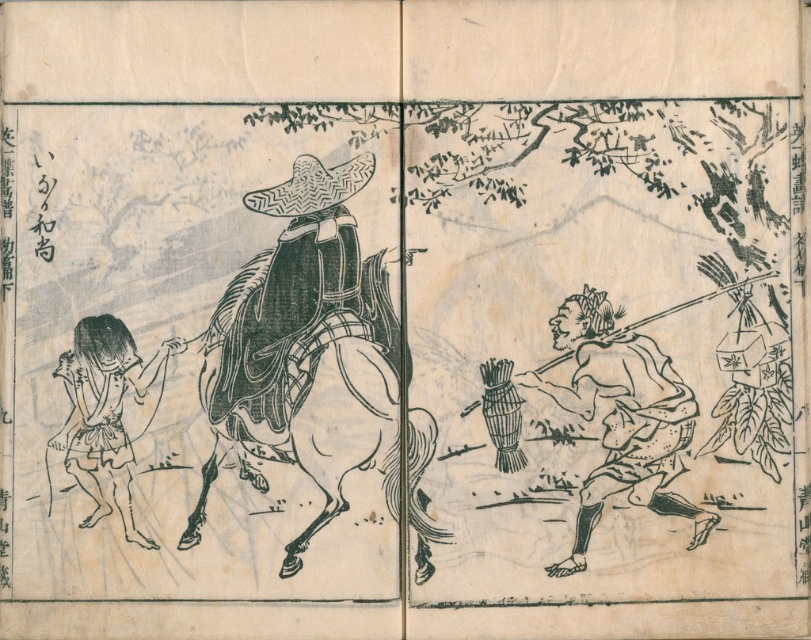
Who is lower down, wooden staff at lower right or black paper doll at lower left?

black paper doll at lower left is below.

Which is more to the right, wooden staff at lower right or black paper doll at lower left?

Positioned to the right is wooden staff at lower right.

Between point (649, 442) and point (121, 344), which one is positioned behind?

The point (649, 442) is more distant.

Where is `wooden staff at lower right`? This screenshot has width=811, height=640. wooden staff at lower right is located at coordinates (621, 417).

Can you confirm if black paper doll at lower left is taller than woven straw hat at center?

Yes.

Can you confirm if black paper doll at lower left is positioned to the right of woven straw hat at center?

In fact, black paper doll at lower left is to the left of woven straw hat at center.

Is point (88, 518) farther from viewer compared to point (282, 202)?

No, it is not.

Where is `black paper doll at lower left`? This screenshot has width=811, height=640. black paper doll at lower left is located at coordinates (108, 413).

Does white paper horse at center have a larger size compared to black paper doll at lower left?

Correct, white paper horse at center is larger in size than black paper doll at lower left.

Is point (262, 412) farther from camera compared to point (97, 321)?

Yes, it is.

Locate an element on the screen. white paper horse at center is located at coordinates (303, 374).